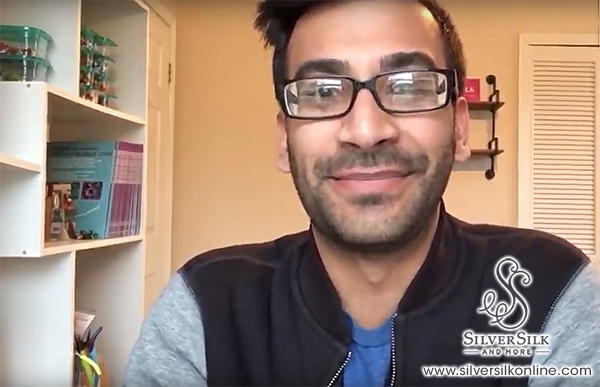
In order to click on white bi-fold doors in this screenshot , I will do `click(555, 178)`.